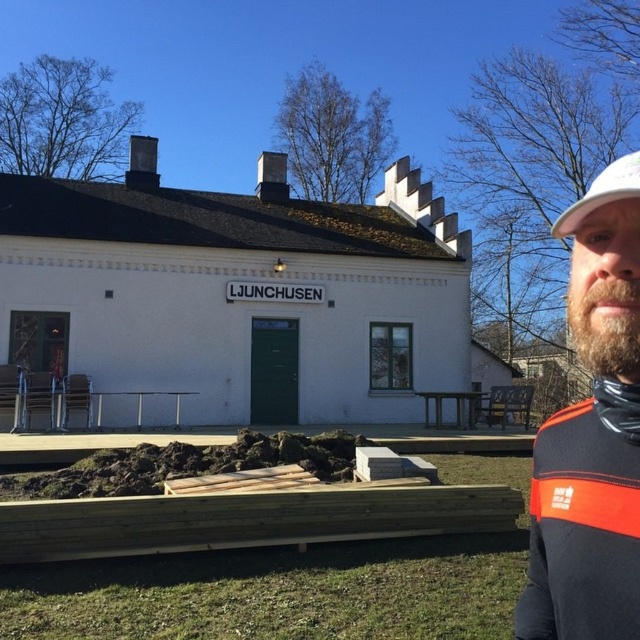
Question: Based on their relative distances, which object is nearer to the white matte baseball cap at upper right?

Choices:
 (A) dark brown leather jacket at right
 (B) brownwoodybeard at right

Answer: (B)

Question: Which point appears closest to the camera in this image?

Choices:
 (A) (602, 342)
 (B) (611, 458)
 (C) (564, 230)

Answer: (A)

Question: Is dark brown leather jacket at right further to the viewer compared to brownwoodybeard at right?

Choices:
 (A) no
 (B) yes

Answer: (A)

Question: Is brownwoodybeard at right above white matte baseball cap at upper right?

Choices:
 (A) no
 (B) yes

Answer: (A)

Question: Can you confirm if dark brown leather jacket at right is smaller than white matte baseball cap at upper right?

Choices:
 (A) yes
 (B) no

Answer: (A)

Question: Among these objects, which one is nearest to the camera?

Choices:
 (A) brownwoodybeard at right
 (B) white matte baseball cap at upper right

Answer: (A)